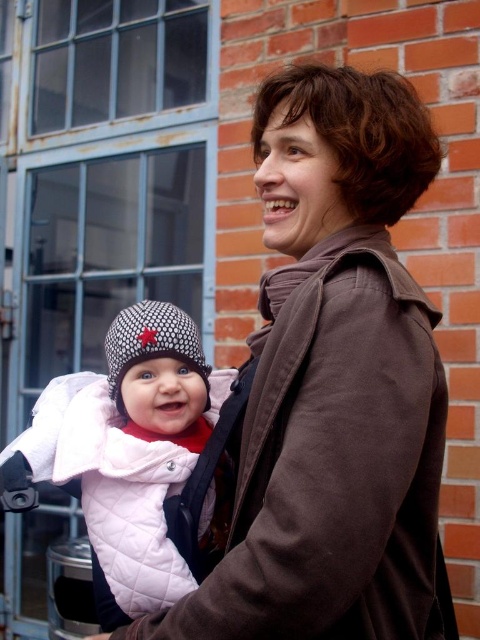
Question: Which is nearer to the brown suede coat at center?

Choices:
 (A) knitted woolen hat at center
 (B) white quilted jacket at center

Answer: (B)

Question: Where is brown suede coat at center located in relation to white quilted jacket at center in the image?

Choices:
 (A) below
 (B) above

Answer: (B)

Question: Which point is farther to the camera?

Choices:
 (A) white quilted jacket at center
 (B) brown suede coat at center
 (C) knitted woolen hat at center

Answer: (C)

Question: Does white quilted jacket at center appear on the left side of knitted woolen hat at center?

Choices:
 (A) no
 (B) yes

Answer: (B)

Question: Is the position of brown suede coat at center more distant than that of white quilted jacket at center?

Choices:
 (A) yes
 (B) no

Answer: (B)

Question: Which point is closer to the camera taking this photo?

Choices:
 (A) (266, 348)
 (B) (124, 349)
 (C) (79, 392)

Answer: (A)